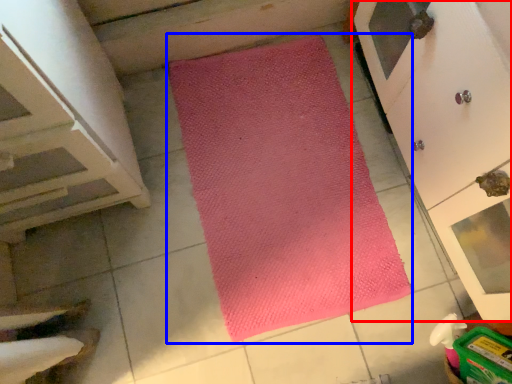
Question: Which point is closer to the camera, cupboard (highlighted by a red box) or mat (highlighted by a blue box)?

Choices:
 (A) cupboard
 (B) mat

Answer: (A)